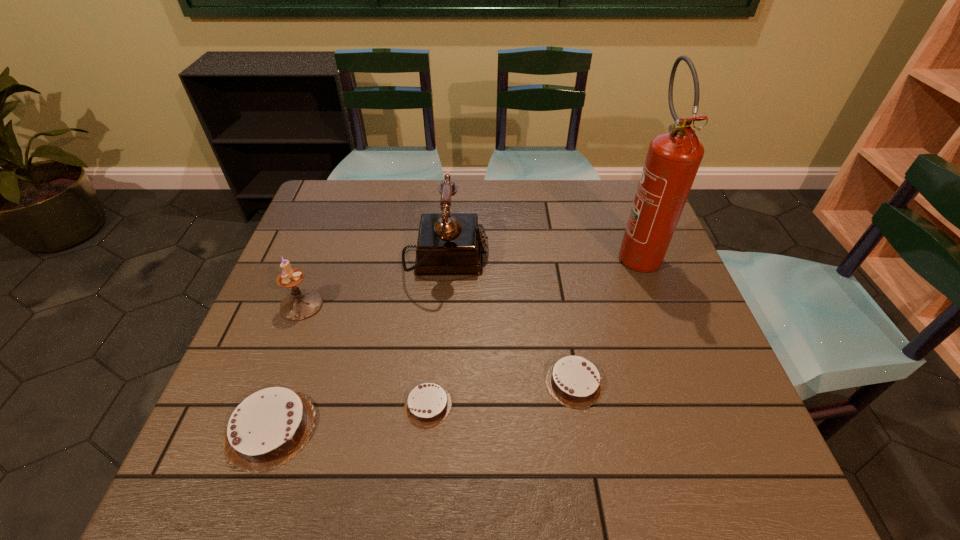
Find the location of a particular element. The width and height of the screenshot is (960, 540). vacant space at the far edge of the desktop is located at coordinates (544, 218).

You are a GUI agent. You are given a task and a screenshot of the screen. Output one action in this format:
    pyautogui.click(x=<x>, y=<y>)
    Task: Click on the free location at the near edge
    This screenshot has height=540, width=960.
    Given the screenshot: What is the action you would take?
    pyautogui.click(x=437, y=426)

In the image, there is a desktop. Find the location of `vacant space at the left edge`. vacant space at the left edge is located at coordinates (265, 374).

You are a GUI agent. You are given a task and a screenshot of the screen. Output one action in this format:
    pyautogui.click(x=<x>, y=<y>)
    Task: Click on the free space at the right edge of the desktop
    The width and height of the screenshot is (960, 540).
    Given the screenshot: What is the action you would take?
    pyautogui.click(x=669, y=262)

In the image, there is a desktop. Find the location of `blank space at the far left corner`. blank space at the far left corner is located at coordinates (332, 194).

At what (x,y) coordinates should I click in order to perform the action: click on vacant space at the far right corner of the desktop. Please return your answer as a coordinate pair (x, y). Image resolution: width=960 pixels, height=540 pixels. Looking at the image, I should click on (620, 220).

The height and width of the screenshot is (540, 960). I want to click on vacant space at the near right corner of the desktop, so click(673, 424).

This screenshot has height=540, width=960. Find the location of `blank region between the fifth shortest object and the candle holder`. blank region between the fifth shortest object and the candle holder is located at coordinates (373, 281).

Locate an element on the screen. The height and width of the screenshot is (540, 960). empty space between the fire extinguisher and the shortest chocolate cake is located at coordinates (533, 328).

Where is `empty space that is in between the tallest chocolate cake and the fourth shortest object`? Image resolution: width=960 pixels, height=540 pixels. empty space that is in between the tallest chocolate cake and the fourth shortest object is located at coordinates (286, 367).